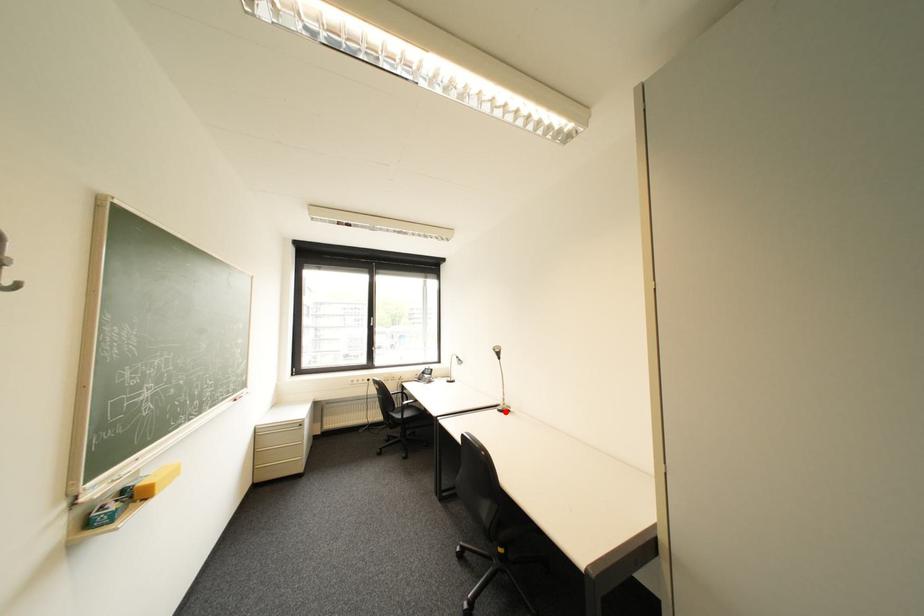
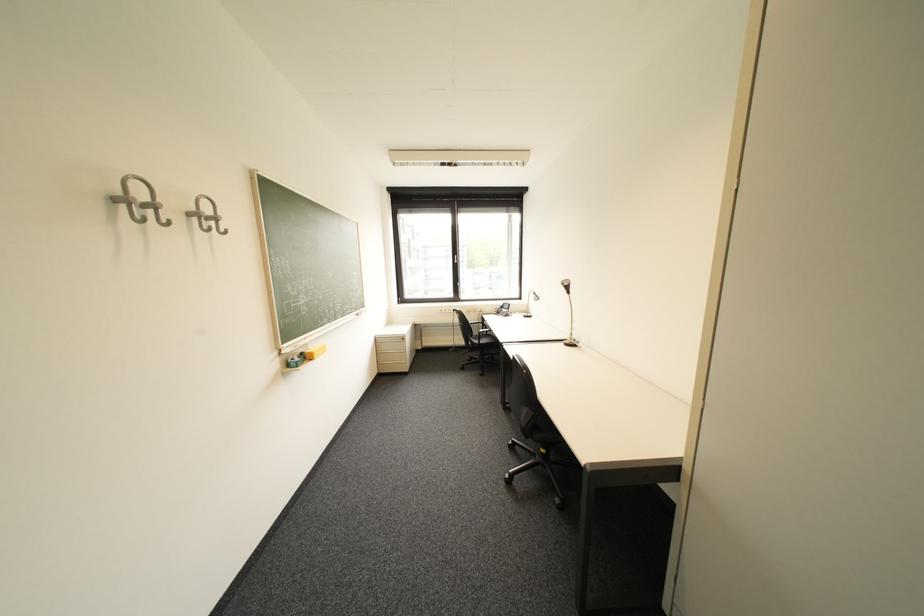
Question: I am providing you with two images of the same scene from different viewpoints. A red point is shown in image1. For the corresponding object point in image2, is it positioned nearer or farther from the camera?

Choices:
 (A) Nearer
 (B) Farther

Answer: (A)